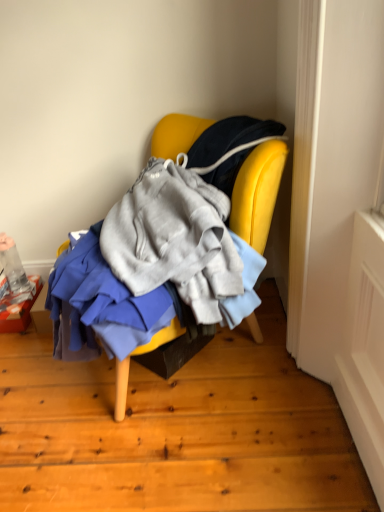
Question: In terms of width, does orange cardboard box at lower left look wider or thinner when compared to yellow fabric chair at center?

Choices:
 (A) thin
 (B) wide

Answer: (A)

Question: Is orange cardboard box at lower left taller or shorter than yellow fabric chair at center?

Choices:
 (A) tall
 (B) short

Answer: (B)

Question: Does point coord(13,307) appear closer or farther from the camera than point coord(155,147)?

Choices:
 (A) closer
 (B) farther

Answer: (B)

Question: Is yellow fabric chair at center spatially inside orange cardboard box at lower left, or outside of it?

Choices:
 (A) outside
 (B) inside

Answer: (A)

Question: In terms of height, does yellow fabric chair at center look taller or shorter compared to orange cardboard box at lower left?

Choices:
 (A) tall
 (B) short

Answer: (A)

Question: Does point (253, 318) appear closer or farther from the camera than point (23, 317)?

Choices:
 (A) farther
 (B) closer

Answer: (B)

Question: From a real-world perspective, is yellow fabric chair at center positioned above or below orange cardboard box at lower left?

Choices:
 (A) below
 (B) above

Answer: (B)